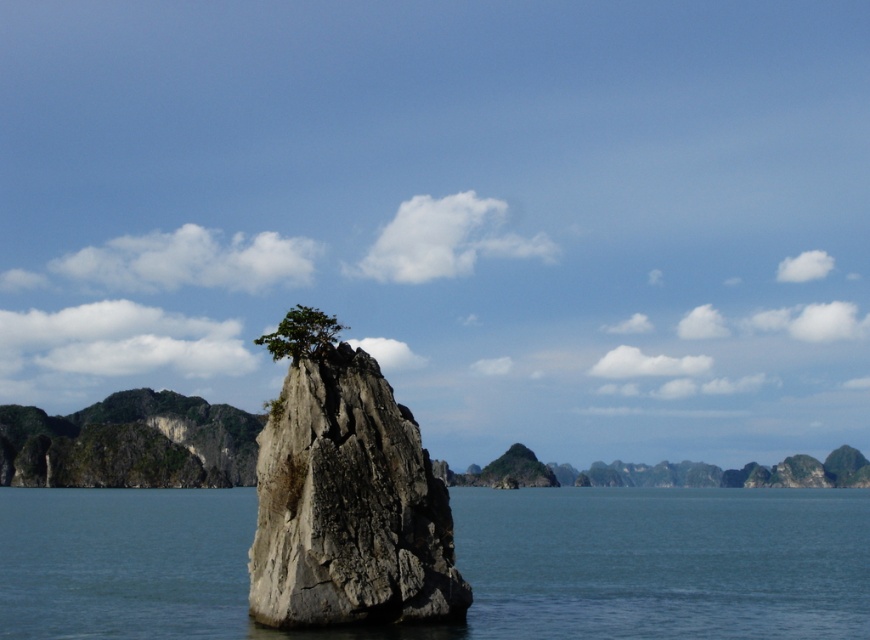
Question: Is gray rough rock at center wider than green leafy tree at center?

Choices:
 (A) no
 (B) yes

Answer: (B)

Question: Can you confirm if clear blue water at center is smaller than green leafy tree at center?

Choices:
 (A) no
 (B) yes

Answer: (A)

Question: Considering the relative positions of clear blue water at center and gray rough rock at center in the image provided, where is clear blue water at center located with respect to gray rough rock at center?

Choices:
 (A) left
 (B) right

Answer: (B)

Question: Which point appears closest to the camera in this image?

Choices:
 (A) (269, 349)
 (B) (246, 529)
 (C) (395, 518)

Answer: (C)

Question: Which point is farther to the camera?

Choices:
 (A) (122, 520)
 (B) (293, 326)
 (C) (325, 406)

Answer: (A)

Question: Which point appears closest to the camera in this image?

Choices:
 (A) (95, 611)
 (B) (336, 326)
 (C) (333, 481)

Answer: (C)